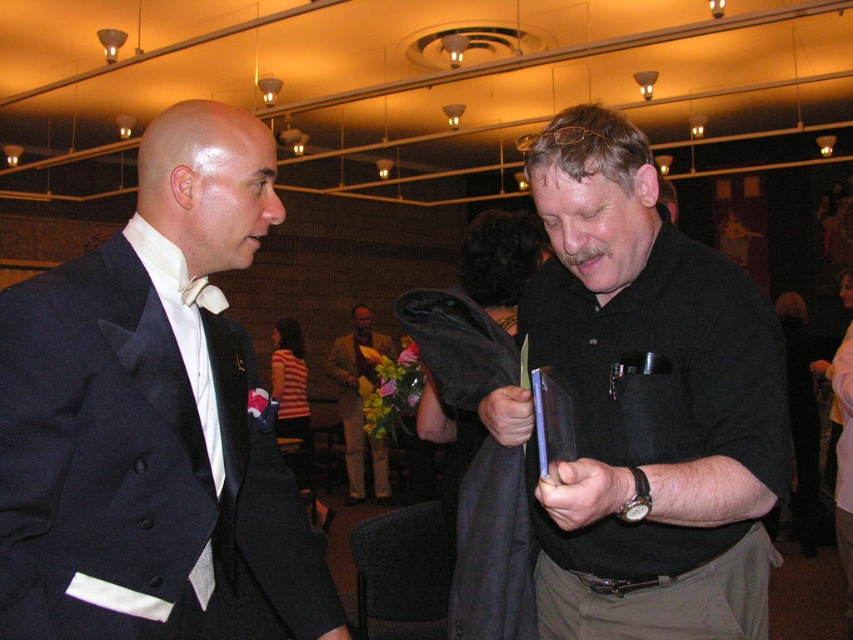
You are standing at the entrance of the hall and want to locate the matte black suit at left. According to the coordinates provided, in which direction should you look to find it?

The matte black suit at left is located at coordinates point (149, 413), which means you should look towards the lower right direction to find it.

You are standing at the entrance of the hall and want to approach the matte black suit at left and the yellow textured suit at center. Which one should you walk towards first to reach them in the order they appear closest to you?

The matte black suit at left is in front of the yellow textured suit at center, so you should walk towards the matte black suit at left first as it is closer to you.

You are organizing a group photo and need to arrange the matte black suit at left and the black matte shirt at center in a row from thinnest to widest. Based on the scene, which order should they be placed in?

The matte black suit at left is thinner than the black matte shirt at center, so they should be arranged in the order matte black suit at left first, followed by black matte shirt at center.